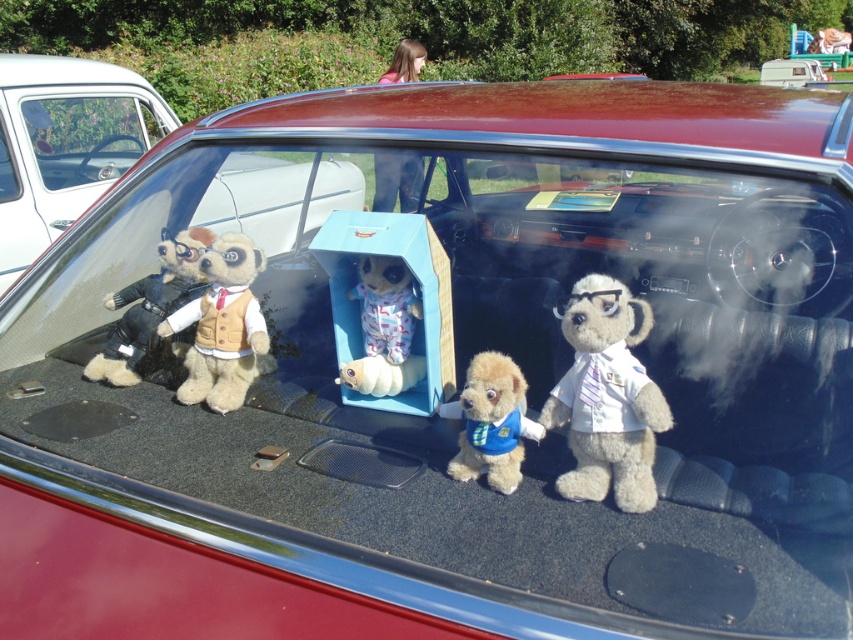
You are a toy organizer trying to stack the velvet teddy bear at left and the soft plush toy at center vertically. Which one should you place at the bottom to ensure stability?

The velvet teddy bear at left is taller than the soft plush toy at center, so placing the taller velvet teddy bear at left at the bottom would provide better stability for the stack.

You are a passenger in the vintage red car and want to hand a snack to the white plush bear at center and the fluffy beige dog at center. Which one can you reach first without moving your seat?

The white plush bear at center is in front of the fluffy beige dog at center, so you can reach the white plush bear at center first without moving your seat.